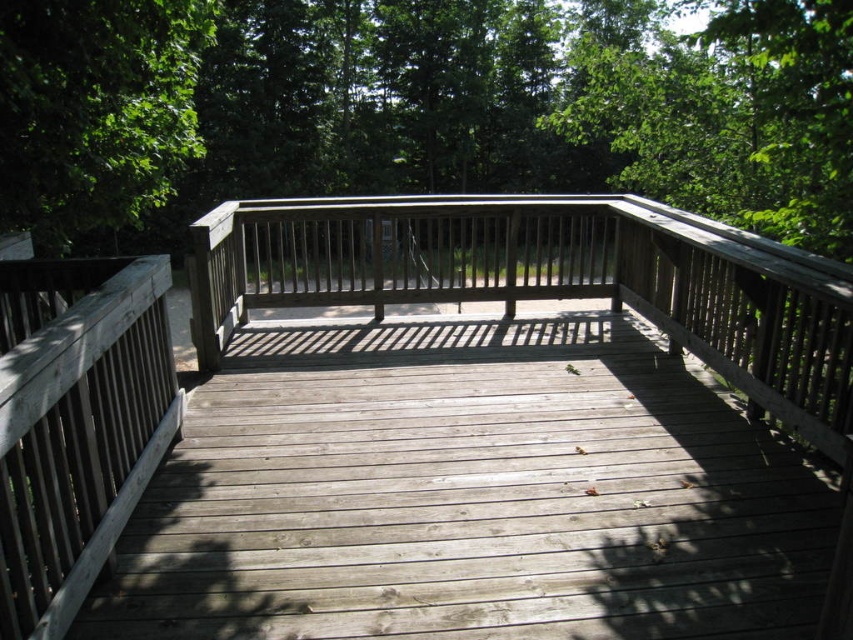
Question: Among these objects, which one is farthest from the camera?

Choices:
 (A) weathered wood bench at center
 (B) green leafy tree at upper left
 (C) green matte fence at upper center

Answer: (B)

Question: Does green matte fence at upper center appear under green leafy tree at upper left?

Choices:
 (A) no
 (B) yes

Answer: (A)

Question: Is the position of green matte fence at upper center more distant than that of weathered wood bench at center?

Choices:
 (A) no
 (B) yes

Answer: (B)

Question: Does green matte fence at upper center have a lesser width compared to weathered wood porch at center?

Choices:
 (A) yes
 (B) no

Answer: (B)

Question: Which point is closer to the camera?

Choices:
 (A) (97, 179)
 (B) (471, 202)

Answer: (A)

Question: Which point is farther to the camera?

Choices:
 (A) (143, 408)
 (B) (425, 237)
 (C) (9, 164)

Answer: (B)